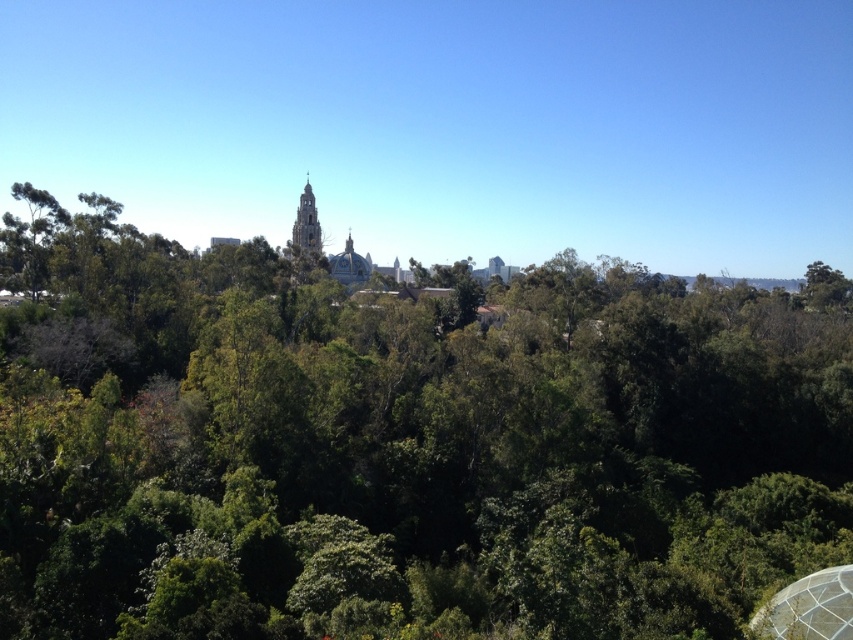
Question: Does green leafy forest at center appear on the left side of green leafy tree at left?

Choices:
 (A) no
 (B) yes

Answer: (A)

Question: Does green leafy forest at center appear over green leafy tree at left?

Choices:
 (A) no
 (B) yes

Answer: (A)

Question: Which of the following is the farthest from the observer?

Choices:
 (A) (45, 198)
 (B) (747, 497)

Answer: (A)

Question: Can you confirm if green leafy forest at center is thinner than green leafy tree at left?

Choices:
 (A) yes
 (B) no

Answer: (B)

Question: Which point appears closest to the camera in this image?

Choices:
 (A) pyautogui.click(x=399, y=296)
 (B) pyautogui.click(x=9, y=227)

Answer: (B)

Question: Which point is farther from the camera taking this photo?

Choices:
 (A) (310, 336)
 (B) (27, 253)

Answer: (A)